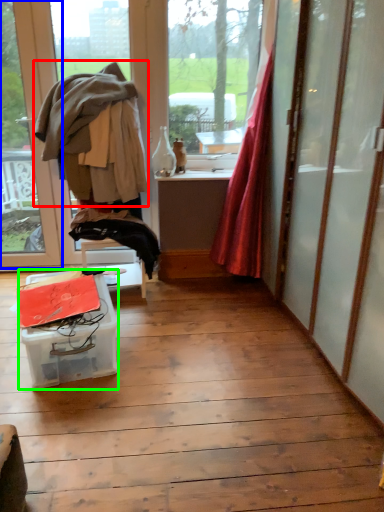
Question: Estimate the real-world distances between objects in this image. Which object is farther from clothing (highlighted by a red box), window (highlighted by a blue box) or table (highlighted by a green box)?

Choices:
 (A) window
 (B) table

Answer: (B)